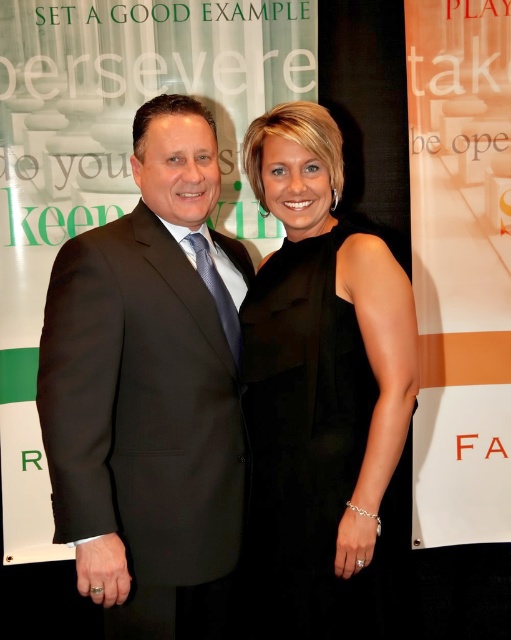
Can you confirm if black satin suit at center is wider than black satin dress at center?

In fact, black satin suit at center might be narrower than black satin dress at center.

Is black satin suit at center smaller than black satin dress at center?

Indeed, black satin suit at center has a smaller size compared to black satin dress at center.

In the scene shown: Who is more distant from viewer, (43, 337) or (280, 484)?

Point (280, 484)

What are the coordinates of `black satin suit at center` in the screenshot? It's located at (150, 390).